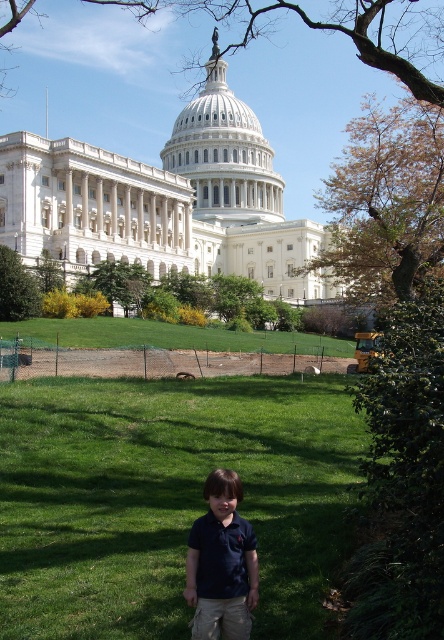
You are a landscape architect designing a walking path between the green leafy tree at lower left and the green leafy tree at center. The path must be exactly 10 meters long. Can you create such a path between them?

The distance between the green leafy tree at lower left and the green leafy tree at center is 9.85 meters, so the path would be 0.15 meters shorter than required. Therefore, you cannot create a 10 meter path between them.

Looking at this image, you are a photographer trying to capture a clear shot of the United States Capitol building. However, there is a brown leafy tree at upper center and a dark blue polo shirt at lower center in the frame. Which object is blocking the view of the Capitol building more to the right side?

The brown leafy tree at upper center is to the right of the dark blue polo shirt at lower center, so it is blocking the view of the Capitol building more to the right side.

You are a photographer trying to capture a clear view of the United States Capitol building. You notice two green leafy trees in your shot. Which tree, the green leafy tree at lower left or the green leafy tree at center, is closer to the ground?

The green leafy tree at lower left is closer to the ground because it is located below the green leafy tree at center.